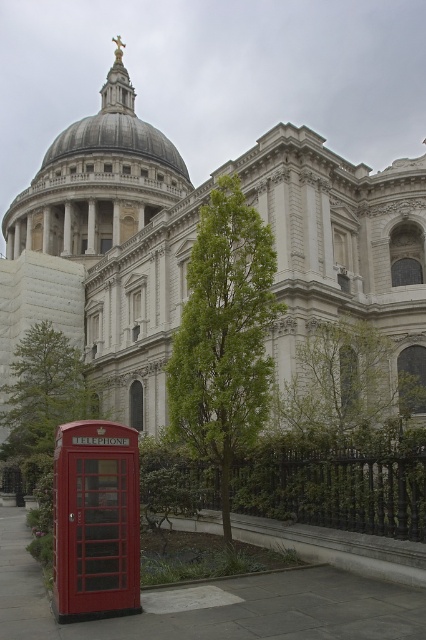
Which is more to the left, green leafy tree at center or green leafy tree at lower left?

green leafy tree at lower left is more to the left.

Between green leafy tree at center and green leafy tree at lower left, which one has less height?

With less height is green leafy tree at lower left.

Which is behind, point (170, 401) or point (58, 333)?

Positioned behind is point (58, 333).

At what (x,y) coordinates should I click in order to perform the action: click on green leafy tree at center. Please return your answer as a coordinate pair (x, y). The height and width of the screenshot is (640, 426). Looking at the image, I should click on (224, 336).

In the scene shown: Who is taller, metallic red telephone box at lower left or green leafy tree at lower left?

With more height is green leafy tree at lower left.

Between point (120, 577) and point (34, 403), which one is positioned behind?

The point (34, 403) is behind.

Which is behind, point (62, 618) or point (28, 435)?

The point (28, 435) is more distant.

Identify the location of metallic red telephone box at lower left. Image resolution: width=426 pixels, height=640 pixels. (95, 522).

Does gray stone dome at center have a larger size compared to metallic red telephone box at lower left?

Correct, gray stone dome at center is larger in size than metallic red telephone box at lower left.

Can you confirm if gray stone dome at center is taller than metallic red telephone box at lower left?

Indeed, gray stone dome at center has a greater height compared to metallic red telephone box at lower left.

The image size is (426, 640). I want to click on gray stone dome at center, so click(97, 179).